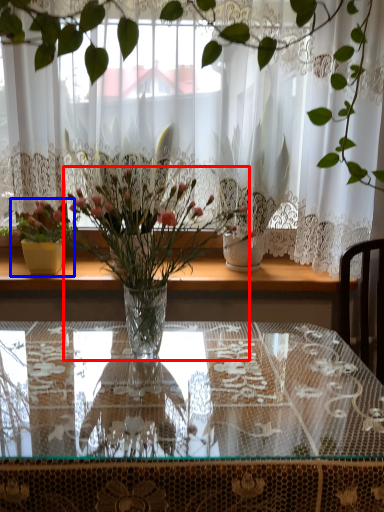
Question: Which object is closer to the camera taking this photo, houseplant (highlighted by a red box) or houseplant (highlighted by a blue box)?

Choices:
 (A) houseplant
 (B) houseplant

Answer: (A)